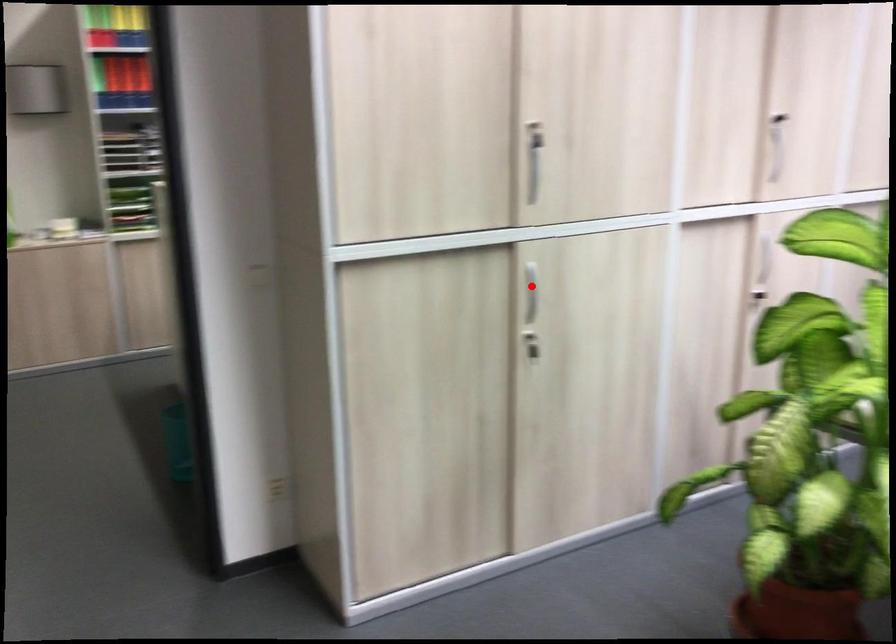
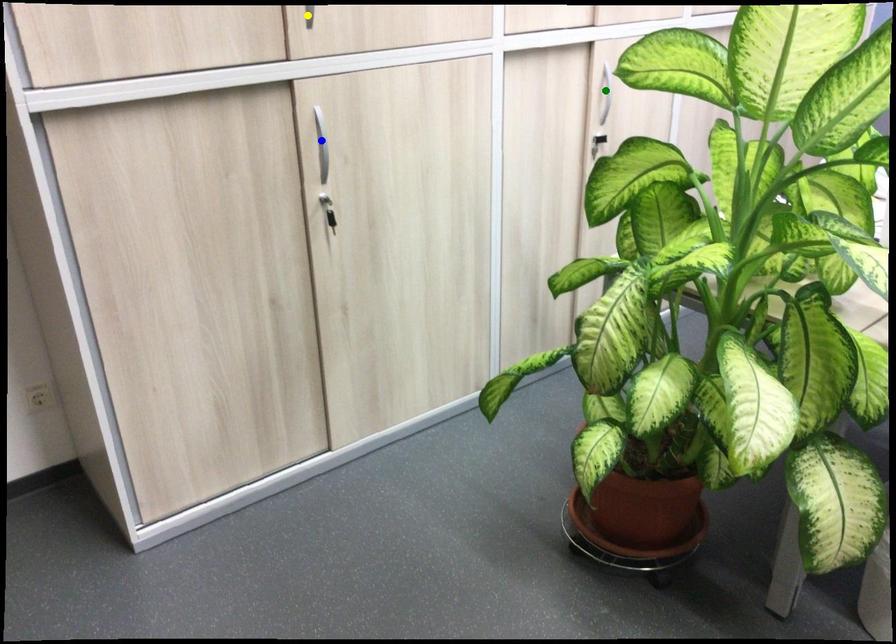
Question: I am providing you with two images of the same scene from different viewpoints. A red point is marked on the first image. You are given multiple points on the second image. In image 2, which mark is for the same physical point as the one in image 1?

Choices:
 (A) blue point
 (B) green point
 (C) yellow point

Answer: (A)